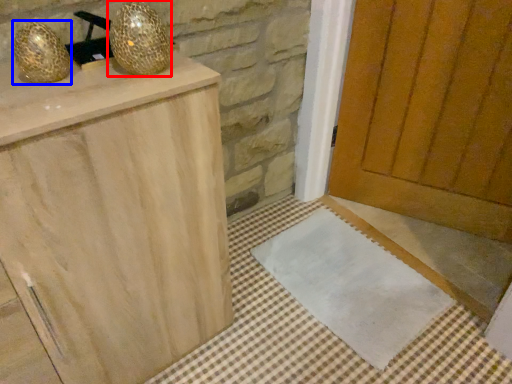
Question: Which object is closer to the camera taking this photo, disco ball (highlighted by a red box) or disco ball (highlighted by a blue box)?

Choices:
 (A) disco ball
 (B) disco ball

Answer: (B)